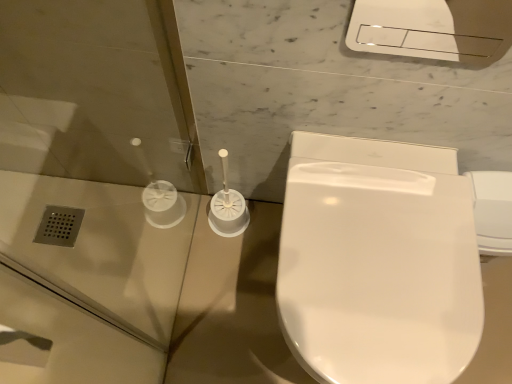
Find the location of a particular element. The image size is (512, 384). white glossy toilet at center is located at coordinates (378, 262).

This screenshot has height=384, width=512. Describe the element at coordinates (378, 262) in the screenshot. I see `white glossy toilet at center` at that location.

Measure the distance between transparent plastic screen door at left and camera.

The depth of transparent plastic screen door at left is 27.66 inches.

In the scene shown: Measure the distance between point (102,302) and camera.

Point (102,302) is 1.19 meters from camera.

Describe the element at coordinates (92, 184) in the screenshot. I see `transparent plastic screen door at left` at that location.

Find the location of a particular element. transparent plastic screen door at left is located at coordinates (92, 184).

Where is `white glossy toilet at center`? white glossy toilet at center is located at coordinates (378, 262).

Can you confirm if transparent plastic screen door at left is positioned to the right of white glossy toilet at center?

Incorrect, transparent plastic screen door at left is not on the right side of white glossy toilet at center.

Between transparent plastic screen door at left and white glossy toilet at center, which one is positioned behind?

white glossy toilet at center is further away from the camera.

Which is less distant, [137,197] or [417,156]?

Point [137,197] appears to be farther away from the viewer than point [417,156].

From the image's perspective, is transparent plastic screen door at left located above white glossy toilet at center?

Yes.

From a real-world perspective, between transparent plastic screen door at left and white glossy toilet at center, who is vertically higher?

transparent plastic screen door at left.

Can you confirm if transparent plastic screen door at left is wider than white glossy toilet at center?

No, transparent plastic screen door at left is not wider than white glossy toilet at center.

Does transparent plastic screen door at left have a lesser height compared to white glossy toilet at center?

No.

Based on their sizes in the image, would you say transparent plastic screen door at left is bigger or smaller than white glossy toilet at center?

In the image, transparent plastic screen door at left appears to be smaller than white glossy toilet at center.

Is white glossy toilet at center a part of transparent plastic screen door at left?

No, white glossy toilet at center is located outside of transparent plastic screen door at left.

Is transparent plastic screen door at left not near white glossy toilet at center?

No, transparent plastic screen door at left is in close proximity to white glossy toilet at center.

Is transparent plastic screen door at left turned away from white glossy toilet at center?

transparent plastic screen door at left does not have its back to white glossy toilet at center.

What's the angular difference between transparent plastic screen door at left and white glossy toilet at center's facing directions?

transparent plastic screen door at left and white glossy toilet at center are facing 87.9 degrees away from each other.

How distant is transparent plastic screen door at left from white glossy toilet at center?

transparent plastic screen door at left and white glossy toilet at center are 54.25 centimeters apart from each other.

Where is `screen door in front of the white glossy toilet at center`? screen door in front of the white glossy toilet at center is located at coordinates (92, 184).

Which is more to the left, white glossy toilet at center or transparent plastic screen door at left?

transparent plastic screen door at left is more to the left.

Which object is further away from the camera taking this photo, white glossy toilet at center or transparent plastic screen door at left?

white glossy toilet at center.

Is point (301, 258) closer or farther from the camera than point (30, 190)?

Clearly, point (301, 258) is closer to the camera than point (30, 190).

From the image's perspective, which is above, white glossy toilet at center or transparent plastic screen door at left?

transparent plastic screen door at left.

From a real-world perspective, is white glossy toilet at center over transparent plastic screen door at left?

Actually, white glossy toilet at center is physically below transparent plastic screen door at left in the real world.

Which object is wider, white glossy toilet at center or transparent plastic screen door at left?

white glossy toilet at center.

Is white glossy toilet at center taller or shorter than transparent plastic screen door at left?

In the image, white glossy toilet at center appears to be shorter than transparent plastic screen door at left.

Is white glossy toilet at center bigger than transparent plastic screen door at left?

Yes.

Can we say white glossy toilet at center lies outside transparent plastic screen door at left?

Yes, white glossy toilet at center is not within transparent plastic screen door at left.

Is white glossy toilet at center touching transparent plastic screen door at left?

No, white glossy toilet at center is not making contact with transparent plastic screen door at left.

Is transparent plastic screen door at left at the back of white glossy toilet at center?

No.

Measure the distance from white glossy toilet at center to transparent plastic screen door at left.

They are 21.36 inches apart.

The width and height of the screenshot is (512, 384). I want to click on toilet behind the transparent plastic screen door at left, so click(378, 262).

Where is `screen door that is above the white glossy toilet at center (from the image's perspective)`? The height and width of the screenshot is (384, 512). screen door that is above the white glossy toilet at center (from the image's perspective) is located at coordinates (92, 184).

Find the location of `toilet below the transparent plastic screen door at left (from a real-world perspective)`. toilet below the transparent plastic screen door at left (from a real-world perspective) is located at coordinates tap(378, 262).